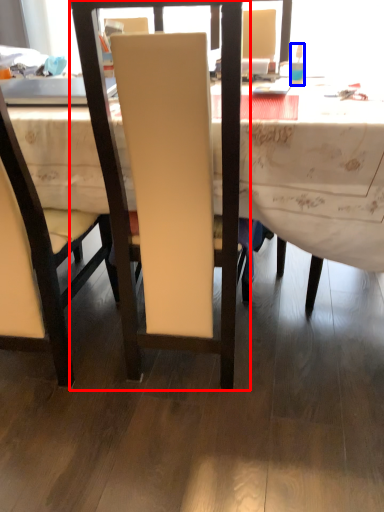
Question: Which object is further to the camera taking this photo, chair (highlighted by a red box) or bottle (highlighted by a blue box)?

Choices:
 (A) chair
 (B) bottle

Answer: (B)